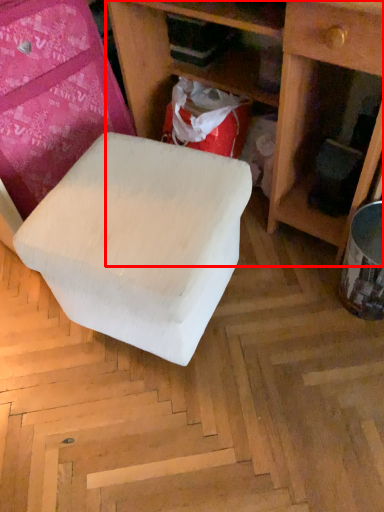
Question: From the image's perspective, what is the correct spatial positioning of shelf (annotated by the red box) in reference to furniture?

Choices:
 (A) below
 (B) above

Answer: (B)